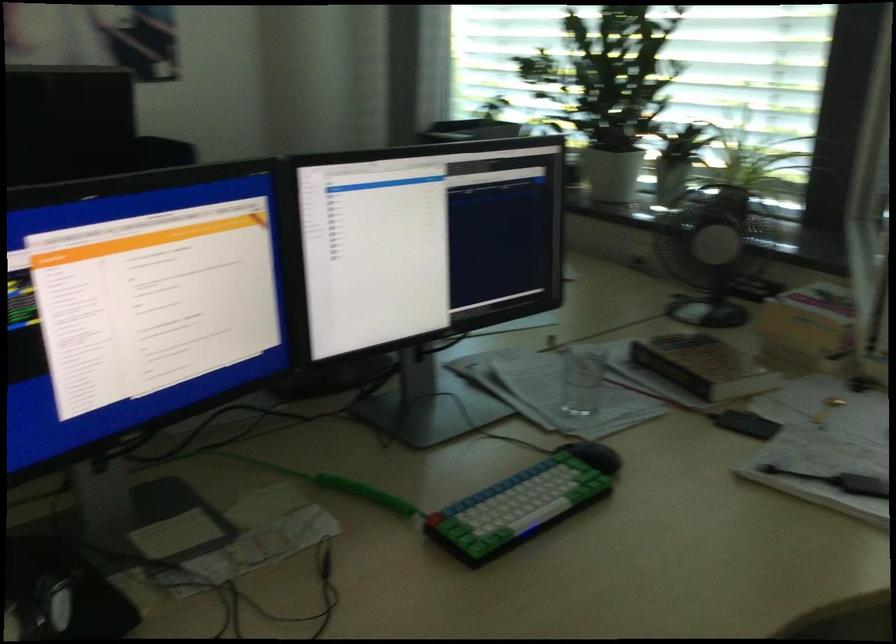
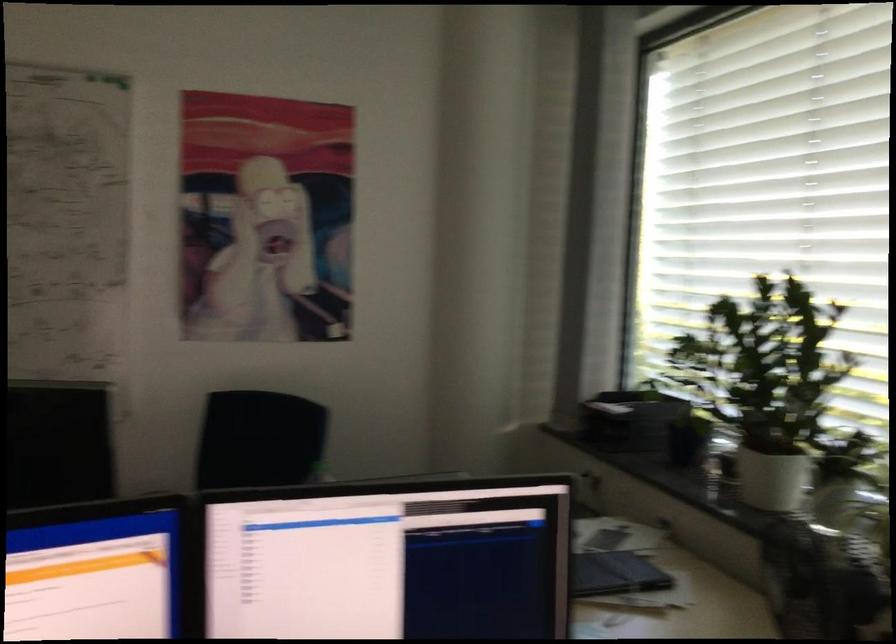
Question: Based on the continuous images, in which direction is the camera rotating? Reply with the corresponding letter.

Choices:
 (A) Left
 (B) Right
 (C) Up
 (D) Down

Answer: (A)